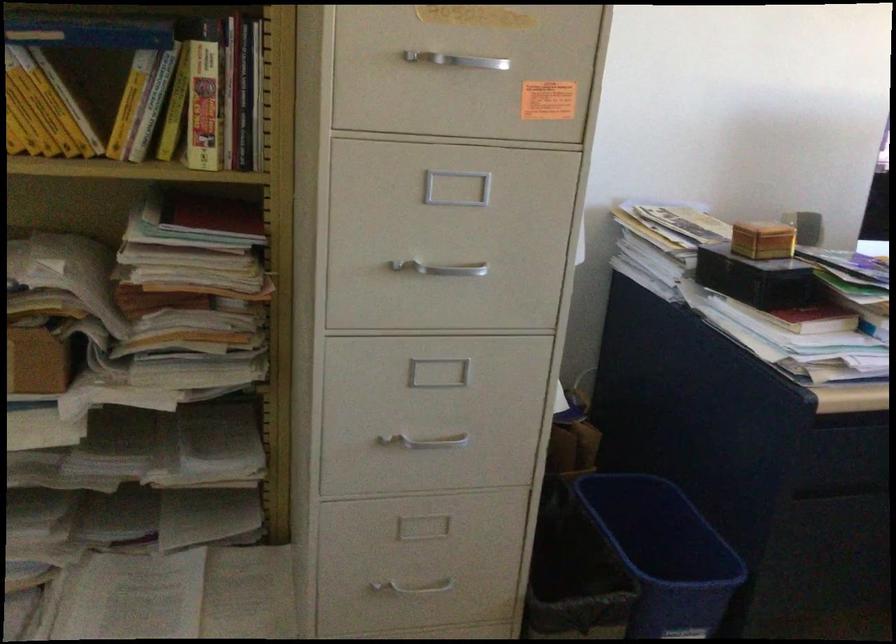
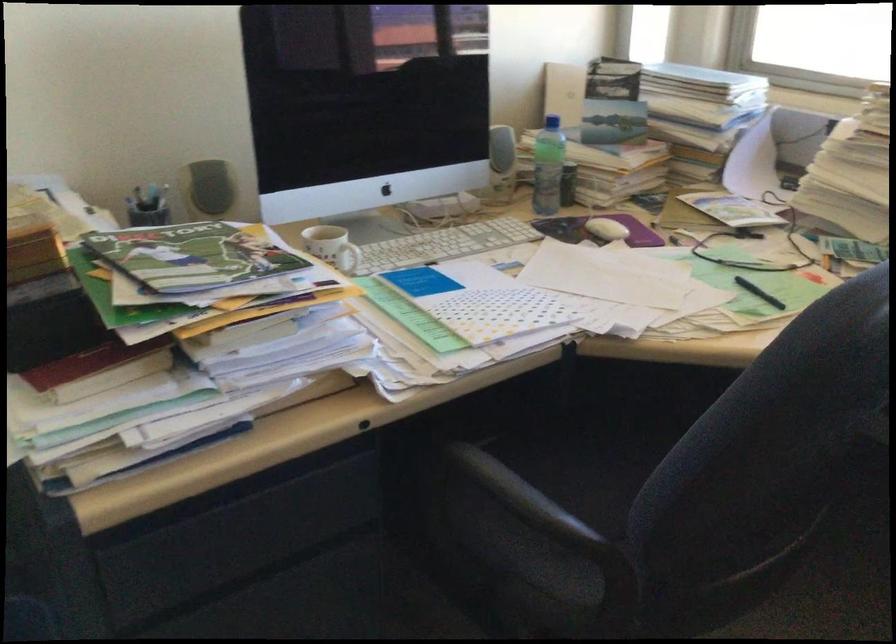
Question: Based on the continuous images, in which direction is the camera rotating? Reply with the corresponding letter.

Choices:
 (A) Left
 (B) Right
 (C) Up
 (D) Down

Answer: (B)